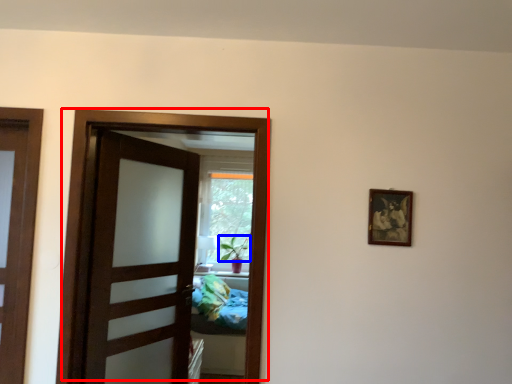
Question: Which of the following is the farthest to the observer, door (highlighted by a red box) or plant (highlighted by a blue box)?

Choices:
 (A) door
 (B) plant

Answer: (B)